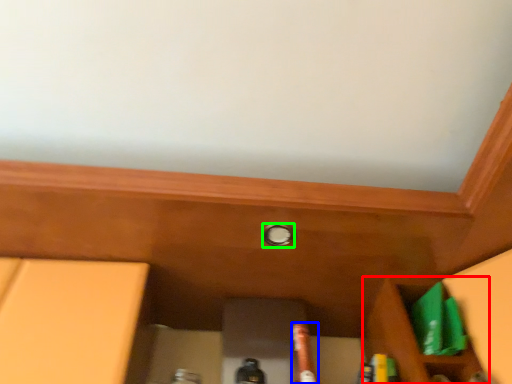
Question: Estimate the real-world distances between objects in this image. Which object is closer to cabinetry (highlighted by a red box), beer bottle (highlighted by a blue box) or knob (highlighted by a green box)?

Choices:
 (A) beer bottle
 (B) knob

Answer: (A)